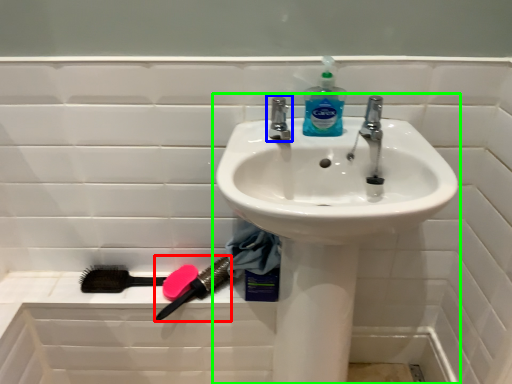
Question: Considering the real-world distances, which object is farthest from brush (highlighted by a red box)? tap (highlighted by a blue box) or sink (highlighted by a green box)?

Choices:
 (A) tap
 (B) sink

Answer: (A)